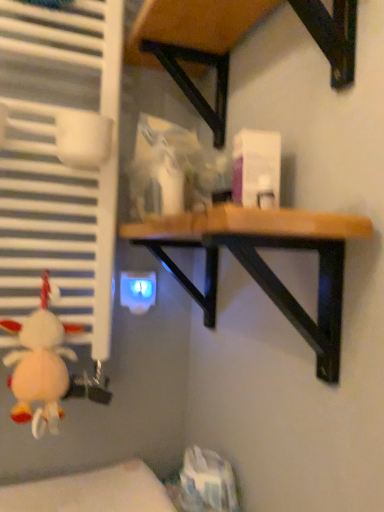
Question: Is wooden table at upper center, which is the 2th table in bottom-to-top order, in front of fluffy white plush at lower left?

Choices:
 (A) no
 (B) yes

Answer: (B)

Question: Considering the relative positions of wooden table at upper center, placed as the 1th table when sorted from top to bottom, and fluffy white plush at lower left in the image provided, is wooden table at upper center, placed as the 1th table when sorted from top to bottom, to the left of fluffy white plush at lower left from the viewer's perspective?

Choices:
 (A) no
 (B) yes

Answer: (A)

Question: Does wooden table at upper center, placed as the 1th table when sorted from top to bottom, turn towards fluffy white plush at lower left?

Choices:
 (A) yes
 (B) no

Answer: (B)

Question: Is wooden table at upper center, which is the 2th table in bottom-to-top order, looking in the opposite direction of fluffy white plush at lower left?

Choices:
 (A) yes
 (B) no

Answer: (B)

Question: Is wooden table at upper center, which is the 2th table in bottom-to-top order, outside of fluffy white plush at lower left?

Choices:
 (A) yes
 (B) no

Answer: (A)

Question: From a real-world perspective, is wooden table at upper center, placed as the 1th table when sorted from top to bottom, on top of fluffy white plush at lower left?

Choices:
 (A) yes
 (B) no

Answer: (A)

Question: Is fluffy white plush at lower left surrounding wooden table at upper center, placed as the 1th table when sorted from top to bottom?

Choices:
 (A) yes
 (B) no

Answer: (B)

Question: From the image's perspective, would you say fluffy white plush at lower left is positioned over wooden table at upper center, which is the 2th table in bottom-to-top order?

Choices:
 (A) no
 (B) yes

Answer: (A)

Question: Is fluffy white plush at lower left not within wooden table at upper center, placed as the 1th table when sorted from top to bottom?

Choices:
 (A) no
 (B) yes

Answer: (B)

Question: Considering the relative sizes of fluffy white plush at lower left and wooden table at upper center, placed as the 1th table when sorted from top to bottom, in the image provided, is fluffy white plush at lower left bigger than wooden table at upper center, placed as the 1th table when sorted from top to bottom,?

Choices:
 (A) yes
 (B) no

Answer: (B)

Question: Can you confirm if fluffy white plush at lower left is shorter than wooden table at upper center, which is the 2th table in bottom-to-top order?

Choices:
 (A) yes
 (B) no

Answer: (B)

Question: From a real-world perspective, is fluffy white plush at lower left positioned under wooden table at upper center, which is the 2th table in bottom-to-top order, based on gravity?

Choices:
 (A) no
 (B) yes

Answer: (B)

Question: From a real-world perspective, is wooden table at upper center, which is the 2th table in bottom-to-top order, beneath wooden table at center, which is the first table in bottom-to-top order?

Choices:
 (A) yes
 (B) no

Answer: (B)